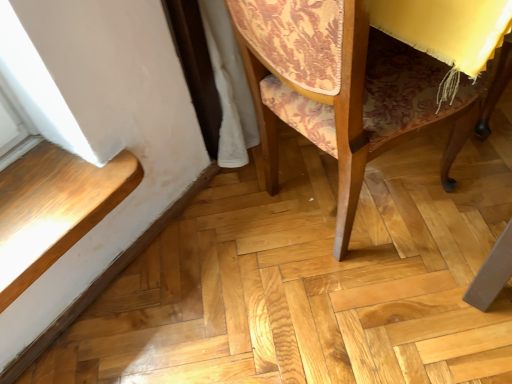
You are a GUI agent. You are given a task and a screenshot of the screen. Output one action in this format:
    pyautogui.click(x=<x>, y=<y>)
    Task: Click on the vacant space to the left of patterned fabric chair at center
    This screenshot has height=384, width=512.
    Given the screenshot: What is the action you would take?
    pyautogui.click(x=208, y=262)